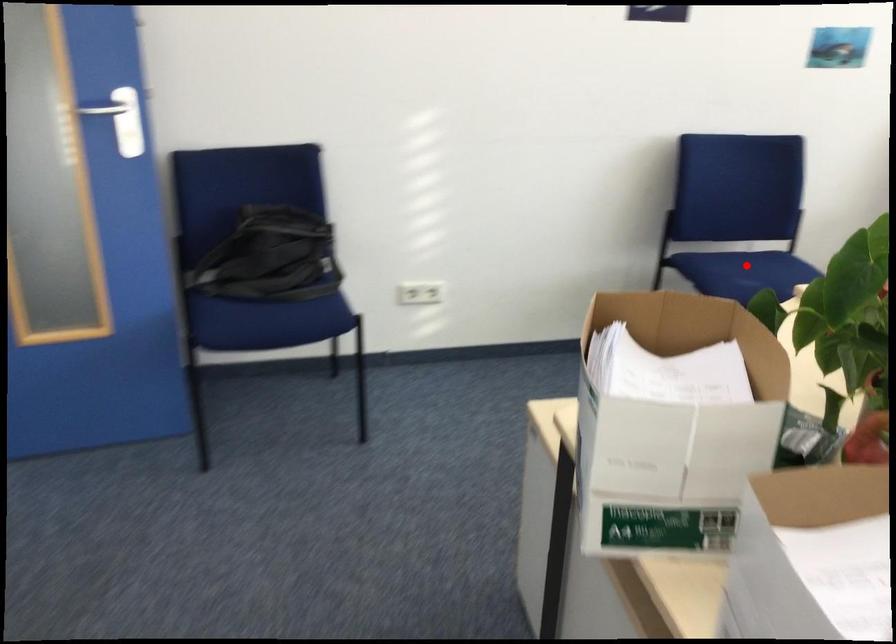
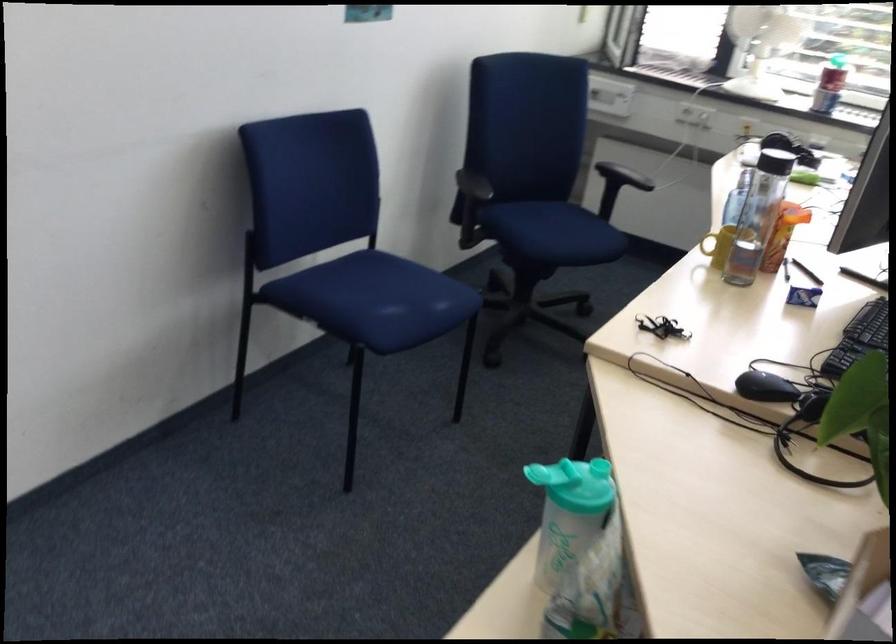
Question: I am providing you with two images of the same scene from different viewpoints. A red point is marked on the first image. Is the red point's position out of view in image 2?

Choices:
 (A) Yes
 (B) No

Answer: (B)